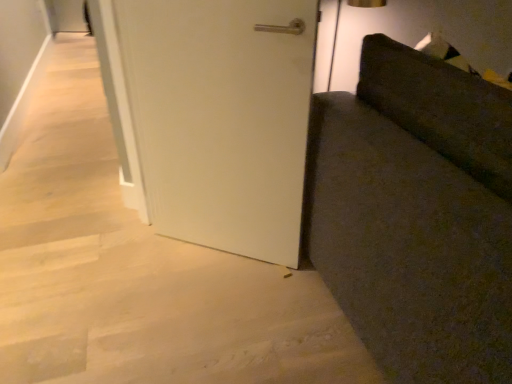
Question: Would you say white matte door at center is to the left or to the right of dark fabric couch at right in the picture?

Choices:
 (A) right
 (B) left

Answer: (B)

Question: Is white matte door at center in front of or behind dark fabric couch at right in the image?

Choices:
 (A) front
 (B) behind

Answer: (B)

Question: From the image's perspective, relative to dark fabric couch at right, is white matte door at center above or below?

Choices:
 (A) below
 (B) above

Answer: (B)

Question: From a real-world perspective, is dark fabric couch at right physically located above or below white matte door at center?

Choices:
 (A) above
 (B) below

Answer: (B)

Question: In terms of width, does dark fabric couch at right look wider or thinner when compared to white matte door at center?

Choices:
 (A) thin
 (B) wide

Answer: (B)

Question: From the image's perspective, is dark fabric couch at right positioned above or below white matte door at center?

Choices:
 (A) below
 (B) above

Answer: (A)

Question: Considering the relative positions of dark fabric couch at right and white matte door at center in the image provided, is dark fabric couch at right to the left or to the right of white matte door at center?

Choices:
 (A) left
 (B) right

Answer: (B)